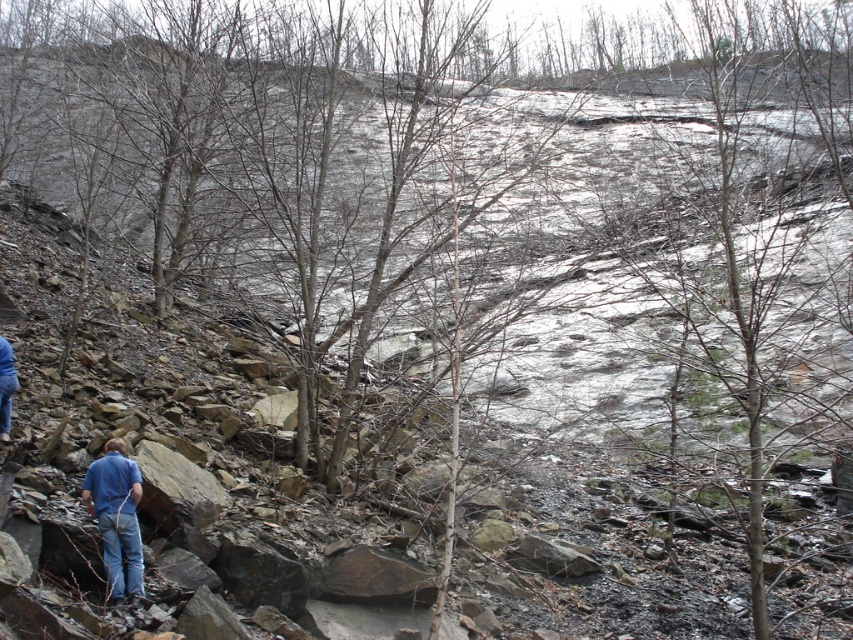
You are a hiker who has lost their blue jeans at lower left and blue denim jeans at lower left. You need to find them quickly before continuing your hike. Which one is bigger in size so you can identify it easily?

The blue jeans at lower left is larger in size than the blue denim jeans at lower left, so you should look for the bigger one to identify it easily.

You are standing at the edge of the rocky terrain in the scene and notice two items at the lower left corner. Which one is positioned lower between the blue jeans at lower left and the blue denim jeans at lower left?

The blue jeans at lower left is positioned lower than the blue denim jeans at lower left according to the description.

From the picture: You are standing at the center of the rocky terrain in the foreground of the image. You need to retrieve the blue jeans at lower left. Which direction should you move to reach them?

The blue jeans at lower left is located at point (115, 518), so you should move to the lower left direction to reach them.